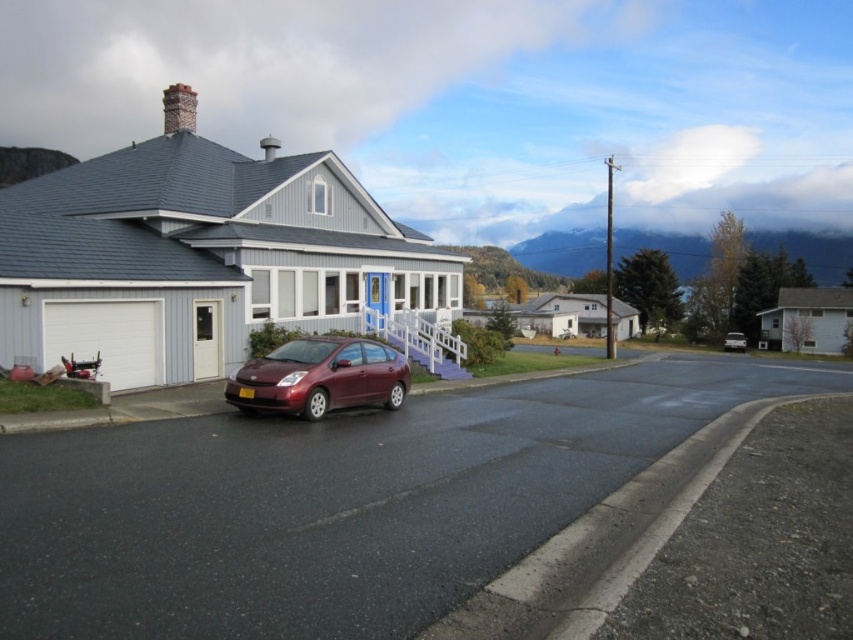
You are a delivery driver who needs to park your truck between the white matte garage at left and the white matte garage at right. Since the truck is 2 meters tall, can you fit it between them?

The white matte garage at left is taller than the white matte garage at right. The truck is 2 meters tall. The height of the white matte garage at right is not specified, so it is impossible to determine if the truck can fit between them.

You are standing at the point marked by the coordinates point (x=807, y=321). What object are you facing?

The point (x=807, y=321) indicates the white matte garage at right, so you are facing the white matte garage at right.

You are a delivery person trying to park your van, which is 4 meters long, in the driveway between the satin burgundy car at lower center and the white matte garage at right. Can your van fit in the space between them?

The satin burgundy car at lower center is shorter than the white matte garage at right, but the description does not provide the exact length of the space between them. Without knowing the distance between the car and the garage, it is impossible to determine if the van will fit.